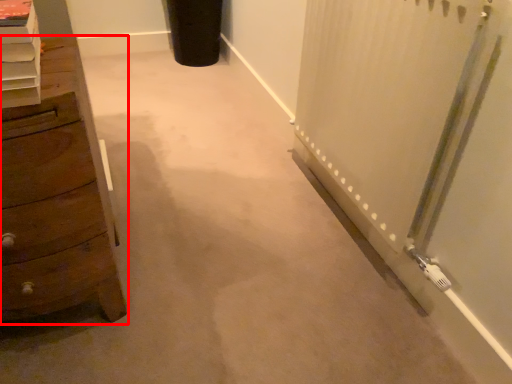
Question: From the image's perspective, considering the relative positions of chest of drawers (annotated by the red box) and shelf in the image provided, where is chest of drawers (annotated by the red box) located with respect to the staircase?

Choices:
 (A) below
 (B) above

Answer: (A)